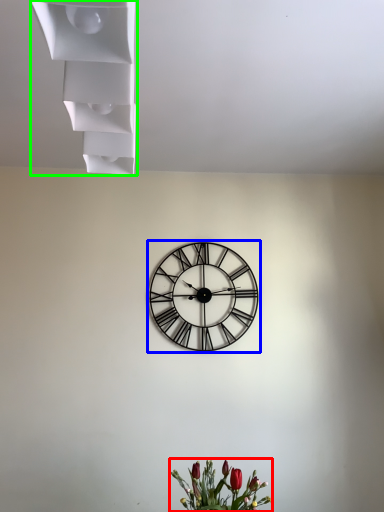
Question: Which object is positioned closest to floral arrangement (highlighted by a red box)? Select from wall clock (highlighted by a blue box) and shelf (highlighted by a green box).

Choices:
 (A) wall clock
 (B) shelf

Answer: (A)